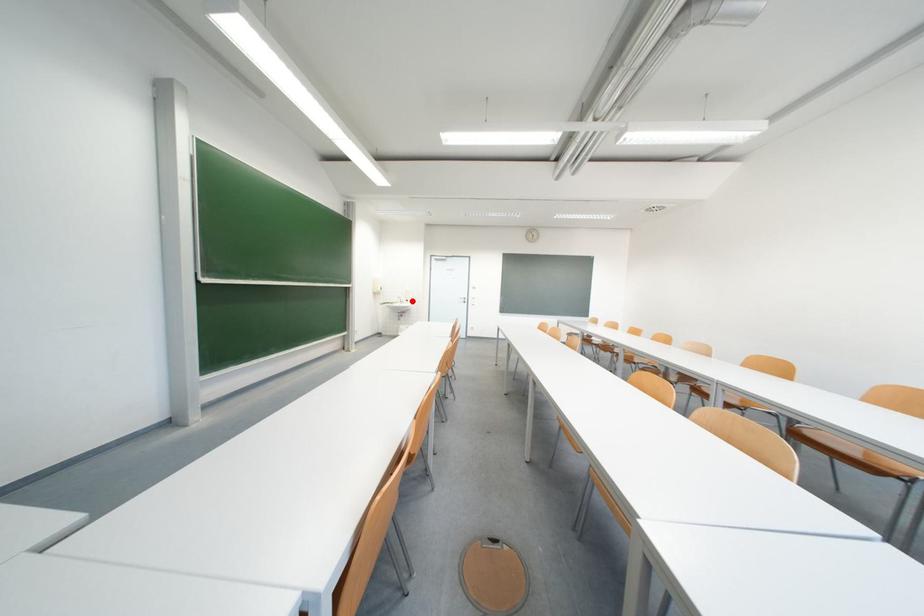
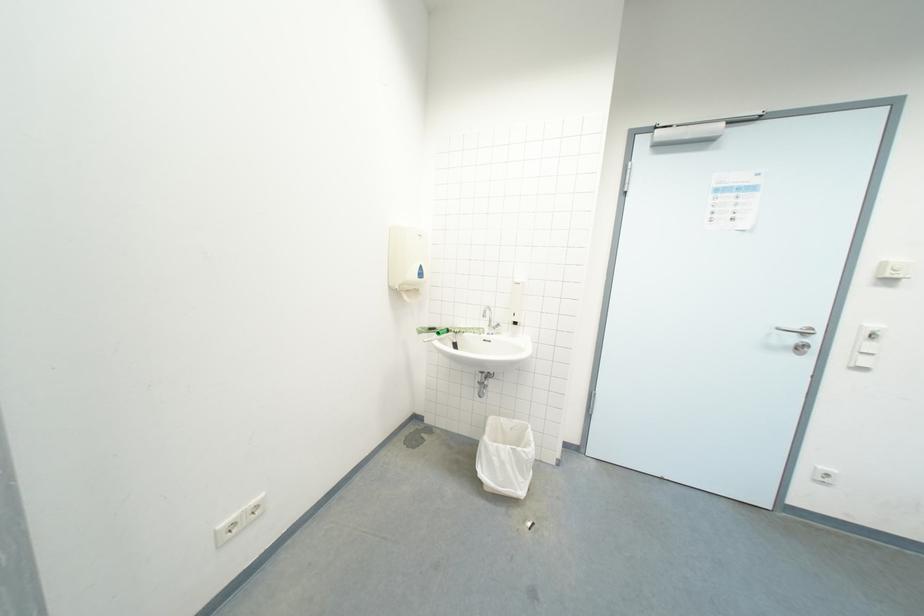
Question: I am providing you with two images of the same scene from different viewpoints. Given a red point in image1, look at the same physical point in image2. Is it:

Choices:
 (A) Closer to the viewpoint
 (B) Farther from the viewpoint

Answer: (A)